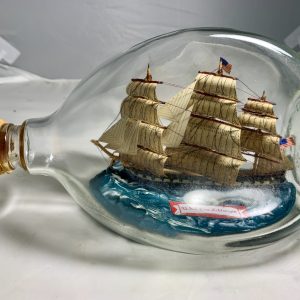
Where is `white wall`? This screenshot has width=300, height=300. white wall is located at coordinates (92, 44).